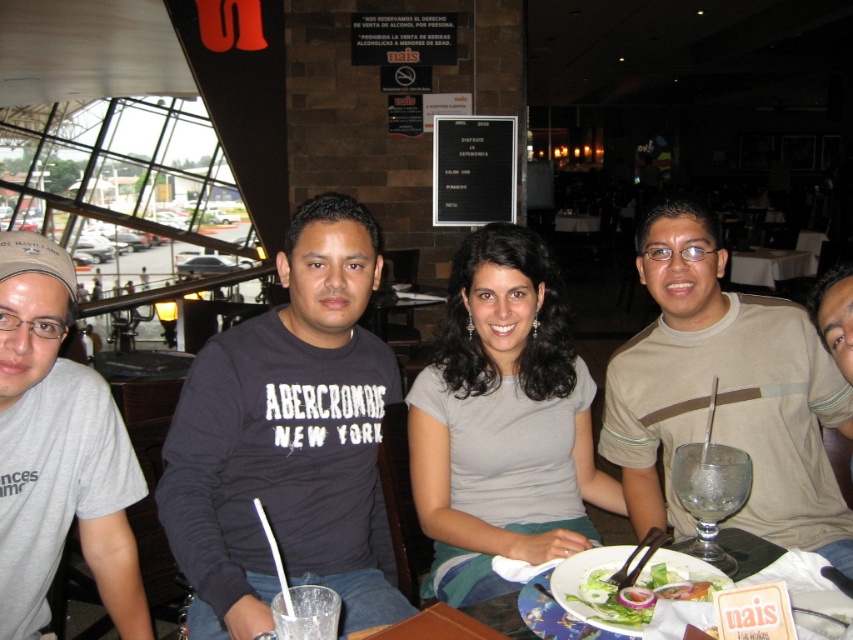
Identify the location of beige cotton shirt at center. The image size is (853, 640). (724, 392).

Which is in front, point (625, 397) or point (798, 253)?

Point (625, 397)

At what (x,y) coordinates should I click in order to perform the action: click on beige cotton shirt at center. Please return your answer as a coordinate pair (x, y). The width and height of the screenshot is (853, 640). Looking at the image, I should click on (724, 392).

Does point (598, 570) come closer to viewer compared to point (729, 534)?

Yes.

Locate an element on the screen. fresh green salad at center is located at coordinates (607, 598).

Is clear glass table at center above white porcelain plate at center?

Correct, clear glass table at center is located above white porcelain plate at center.

What do you see at coordinates (770, 266) in the screenshot? I see `clear glass table at center` at bounding box center [770, 266].

You are a GUI agent. You are given a task and a screenshot of the screen. Output one action in this format:
    pyautogui.click(x=<x>, y=<y>)
    Task: Click on the clear glass table at center
    Image resolution: width=853 pixels, height=640 pixels.
    Given the screenshot: What is the action you would take?
    pyautogui.click(x=770, y=266)